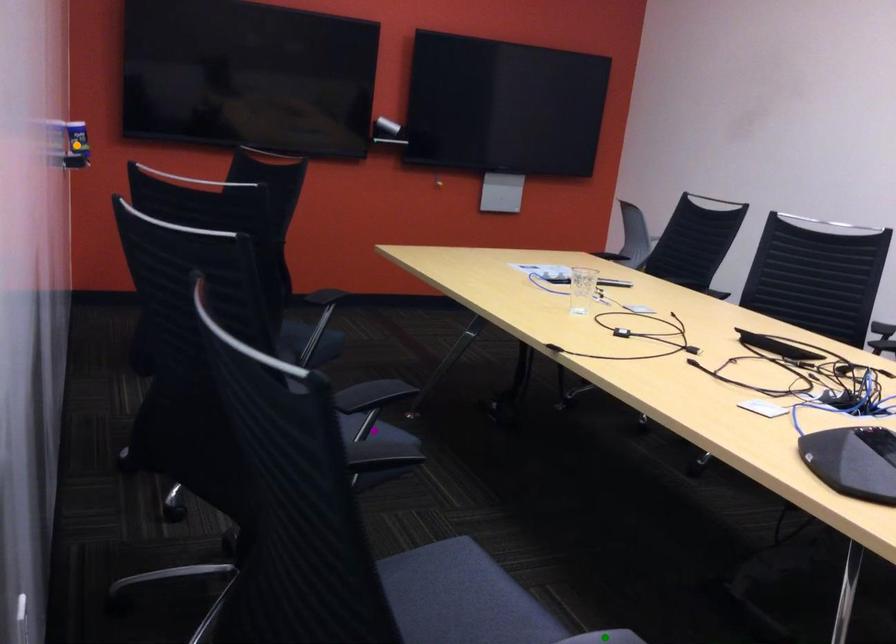
Order these from nearest to farthest:
1. green point
2. orange point
3. purple point

1. orange point
2. purple point
3. green point